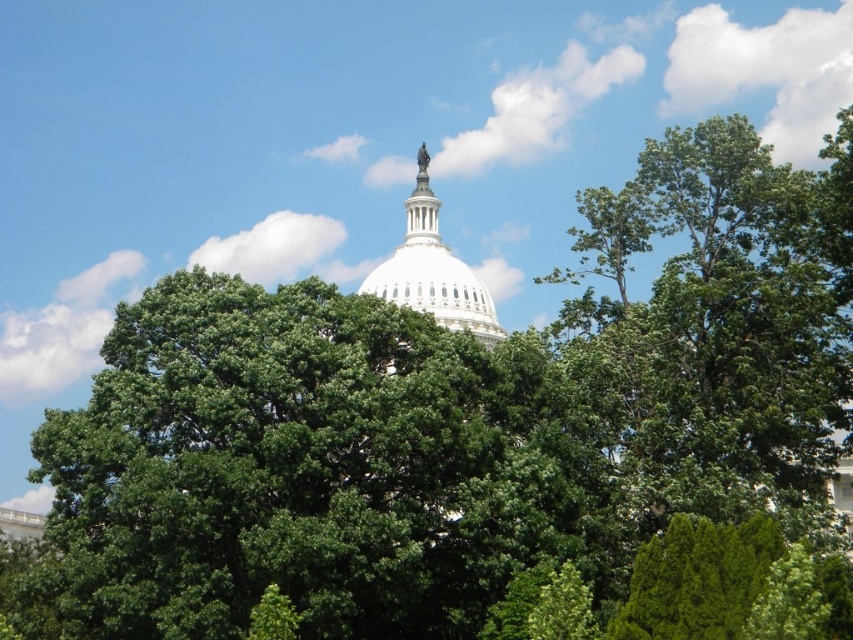
Measure the distance from green leafy tree at upper right to white marble dome at center.

The distance of green leafy tree at upper right from white marble dome at center is 27.89 meters.

From the picture: Can you confirm if green leafy tree at upper right is positioned above white marble dome at center?

Correct, green leafy tree at upper right is located above white marble dome at center.

Identify the location of green leafy tree at upper right. (732, 314).